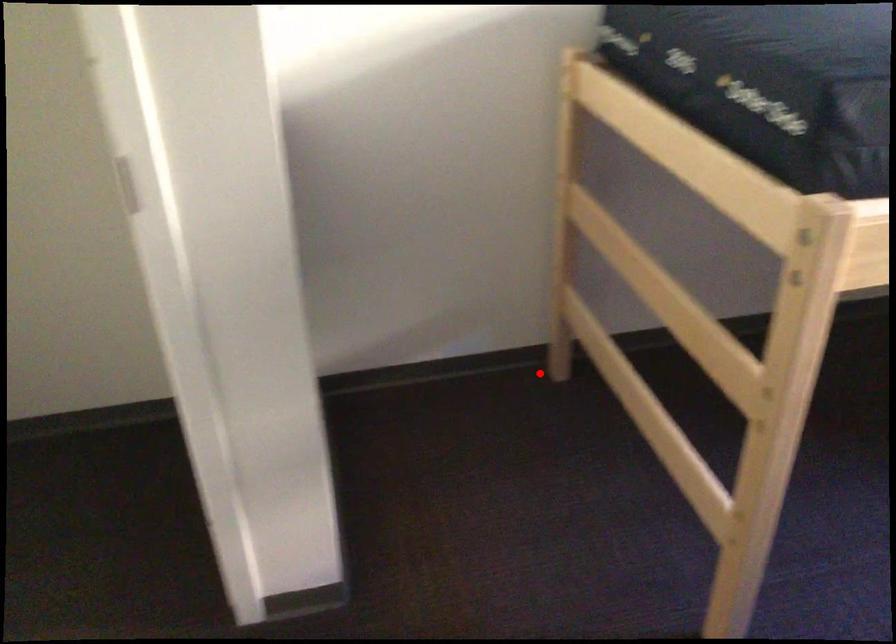
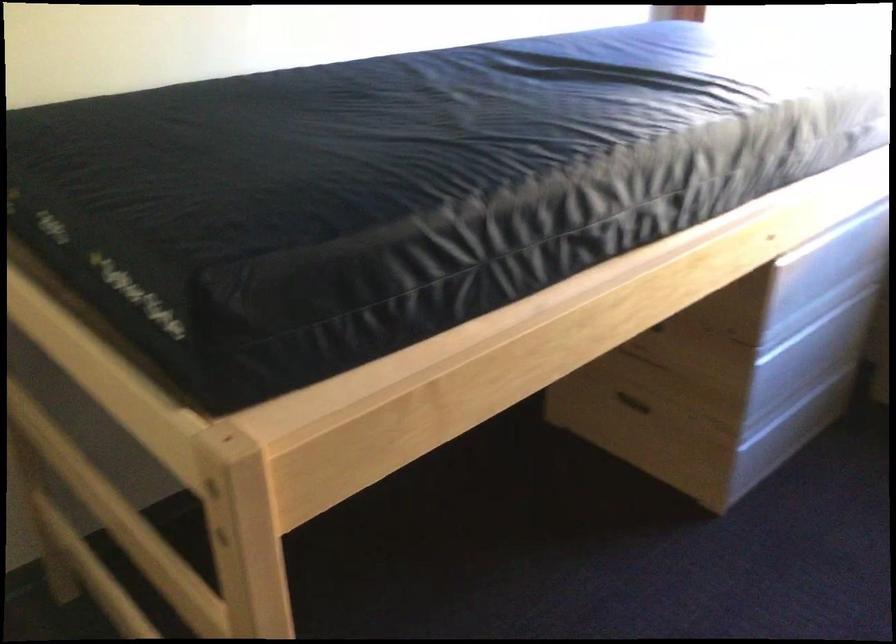
Question: I am providing you with two images of the same scene from different viewpoints. A red point is marked on the first image. At the location where the point appears in image 1, is it still visible in image 2?

Choices:
 (A) Yes
 (B) No

Answer: (A)